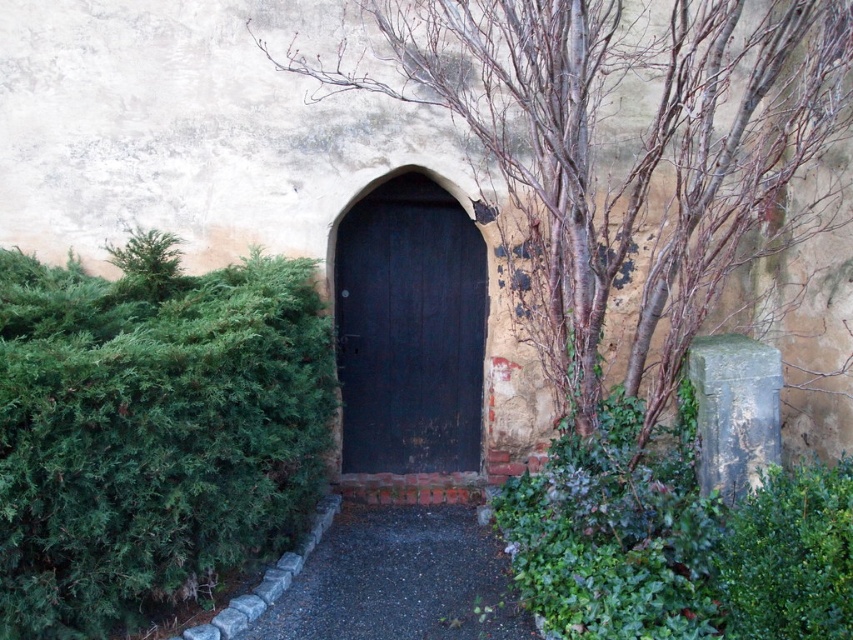
Question: Which object is the farthest from the bark textured tree at center?

Choices:
 (A) green leafy hedge at left
 (B) dark gravel path at center
 (C) dark wood door at center

Answer: (B)

Question: Which point appears farthest from the camera in this image?

Choices:
 (A) pos(140,342)
 (B) pos(625,237)
 (C) pos(329,602)
 (D) pos(434,352)

Answer: (D)

Question: Is bark textured tree at center further to the viewer compared to dark wood door at center?

Choices:
 (A) yes
 (B) no

Answer: (B)

Question: Which object appears closest to the camera in this image?

Choices:
 (A) green leafy hedge at left
 (B) bark textured tree at center

Answer: (A)

Question: Is bark textured tree at center to the right of dark wood door at center from the viewer's perspective?

Choices:
 (A) no
 (B) yes

Answer: (B)

Question: Is bark textured tree at center closer to the viewer compared to dark gravel path at center?

Choices:
 (A) yes
 (B) no

Answer: (A)